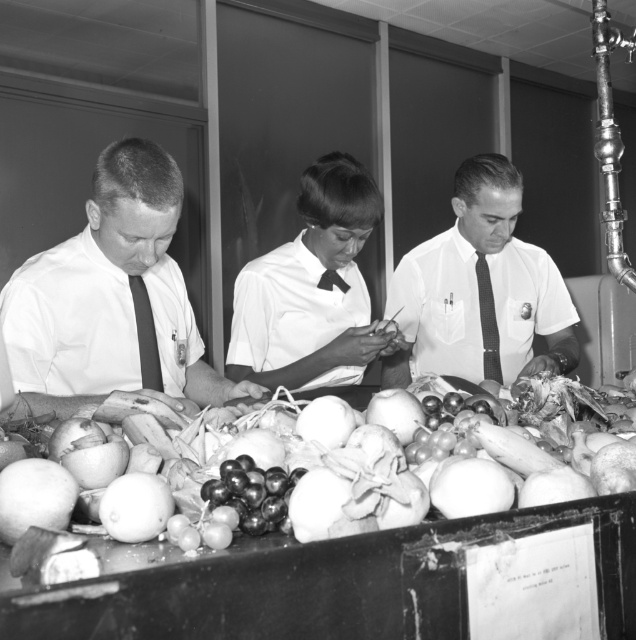
In the image, there are two people wearing white shirts. The person with the matte white shirt at left and the person with the white shirt at center are standing in a market setting. Which of these two individuals is closer to the front of the scene?

The matte white shirt at left is in front of the white shirt at center, so the person wearing the matte white shirt at left is closer to the front of the scene.

You are standing at the position of point (501, 381) and want to walk towards point (141, 323). Based on the scene description, will you be moving forward or backward relative to your current position?

Since point (141, 323) is in front of point (501, 381), moving towards it would mean moving forward.

You are a customer in this market scene. You want to buy a fruit from the table. The table is at point (111, 300). Which person is closest to the table?

The person closest to the table at point (111, 300) is the matte white shirt at left, as they are positioned nearest to that location.